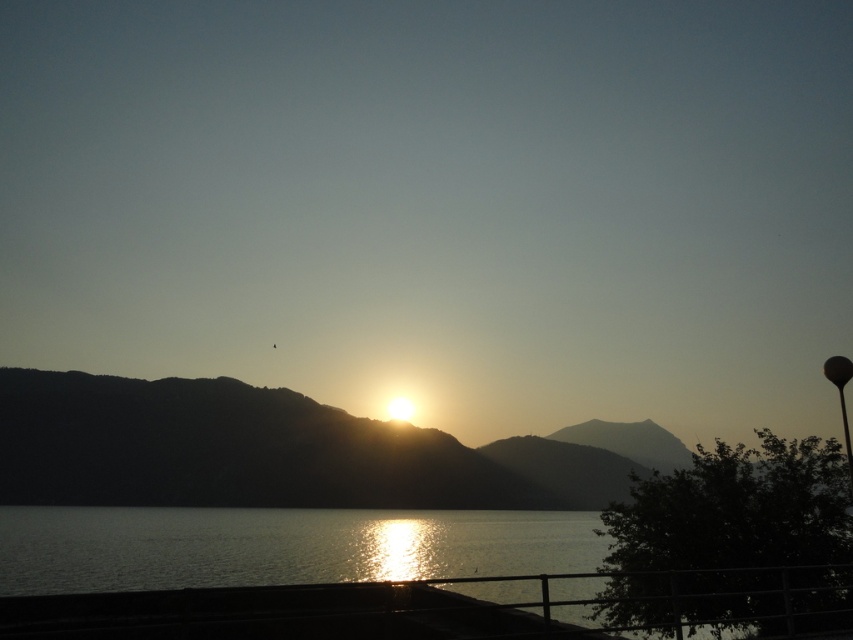
Can you confirm if silvery metallic mountain at center is bigger than glistening water at lower center?

Indeed, silvery metallic mountain at center has a larger size compared to glistening water at lower center.

Does silvery metallic mountain at center have a greater width compared to glistening water at lower center?

Correct, the width of silvery metallic mountain at center exceeds that of glistening water at lower center.

The width and height of the screenshot is (853, 640). Identify the location of silvery metallic mountain at center. (265, 451).

Where is `silvery metallic mountain at center`? This screenshot has width=853, height=640. silvery metallic mountain at center is located at coordinates (265, 451).